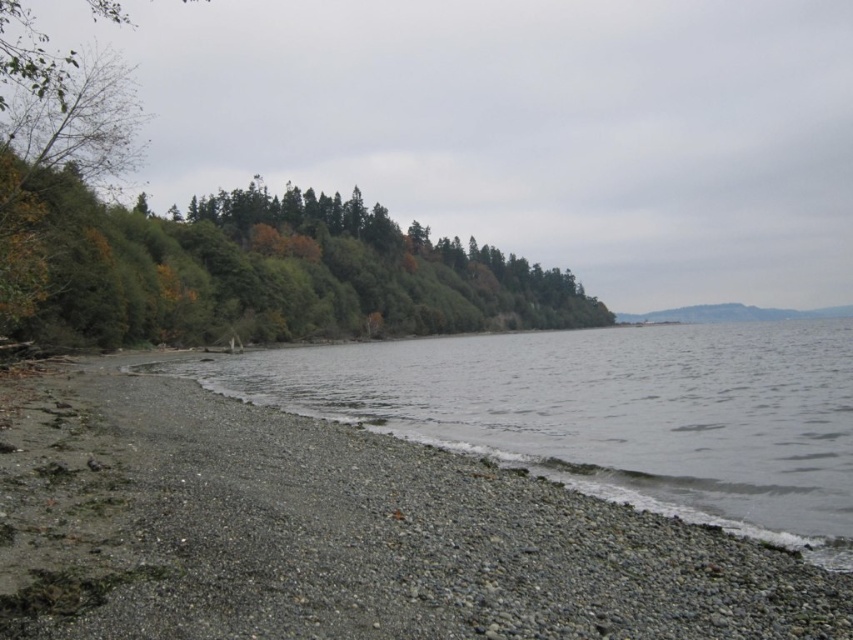
You are standing at the origin point of the coordinate system where the image is displayed. The origin is at the bottom left corner of the image. You want to walk towards the gray gravelly water at lower left. Which direction should you move relative to your current position?

Since the gray gravelly water at lower left is located at coordinate point (608,412), you should move towards the upper right direction from your current position at the origin to reach it.

You are standing at the lakeside and see two points marked on the image. Which point is closer to you, point (479, 356) or point (271, 308)?

Point (479, 356) is in front of point (271, 308), so it is closer to you.